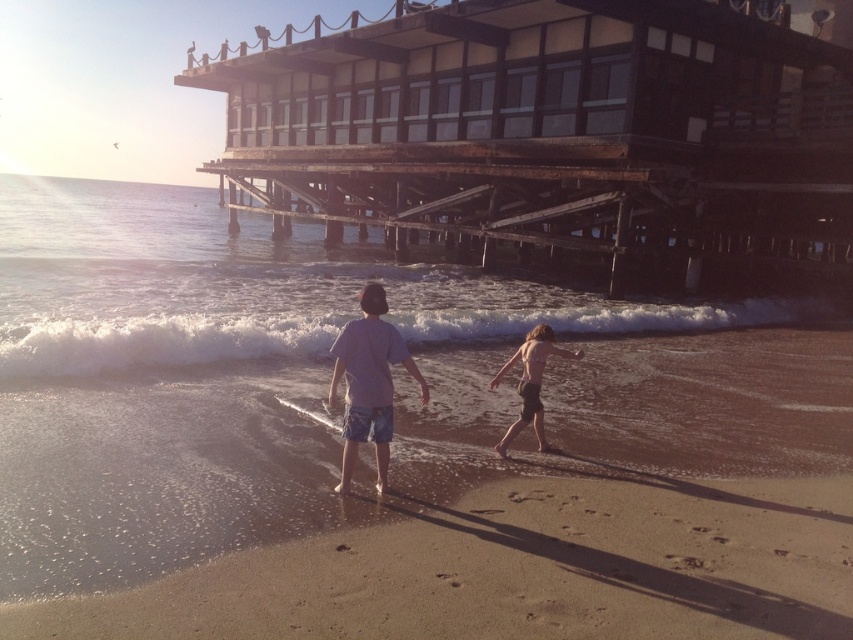
Does brown wooden dock at upper center have a lesser height compared to sandy brown beach at lower center?

No, brown wooden dock at upper center is not shorter than sandy brown beach at lower center.

Can you confirm if brown wooden dock at upper center is taller than sandy brown beach at lower center?

Indeed, brown wooden dock at upper center has a greater height compared to sandy brown beach at lower center.

Locate an element on the screen. brown wooden dock at upper center is located at coordinates (556, 134).

Which is in front, point (672, 234) or point (502, 456)?

Point (502, 456)

Is point (479, 106) behind point (537, 404)?

Yes, point (479, 106) is behind point (537, 404).

Is point (833, 132) farther from viewer compared to point (502, 376)?

Yes.

The width and height of the screenshot is (853, 640). Identify the location of brown wooden dock at upper center. (556, 134).

Is brown wooden dock at upper center behind light blue denim shorts at center?

Yes, brown wooden dock at upper center is further from the viewer.

Does brown wooden dock at upper center lie in front of light blue denim shorts at center?

No.

Who is more forward, (514, 129) or (373, 304)?

Positioned in front is point (373, 304).

Locate an element on the screen. Image resolution: width=853 pixels, height=640 pixels. brown wooden dock at upper center is located at coordinates (556, 134).